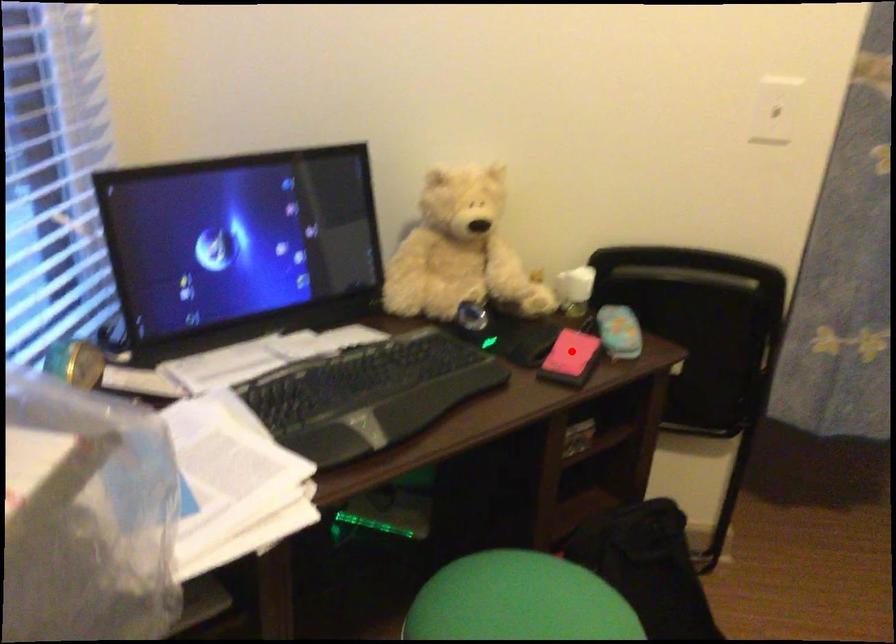
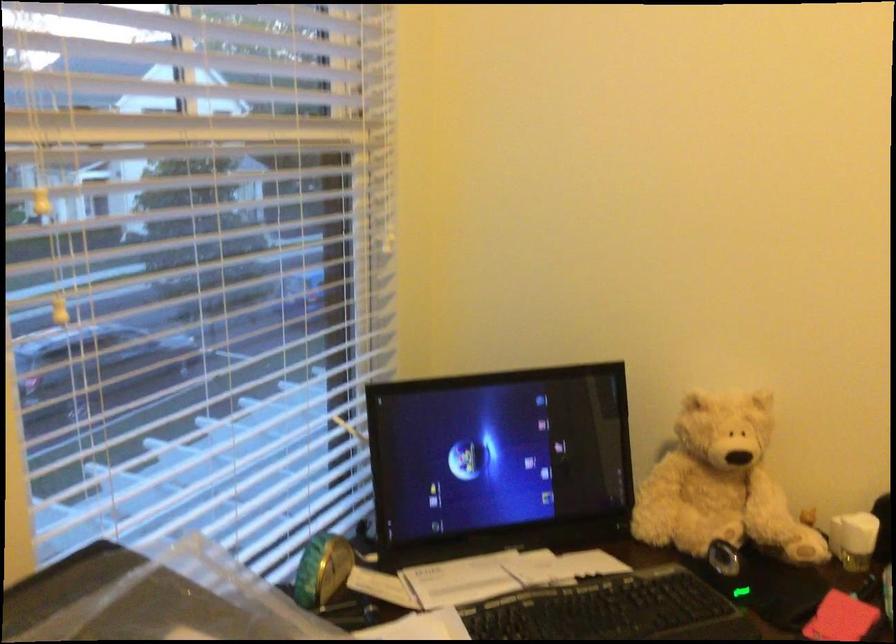
Question: I am providing you with two images of the same scene from different viewpoints. Image1 has a red point marked. In image2, the corresponding 3D location appears at what relative position? Reply with the corresponding letter.

Choices:
 (A) Closer
 (B) Farther

Answer: (A)